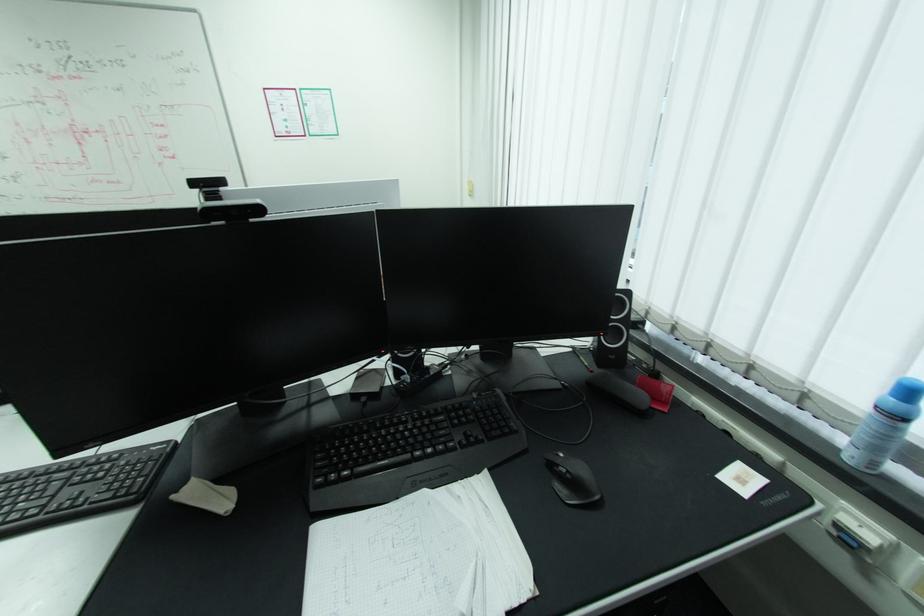
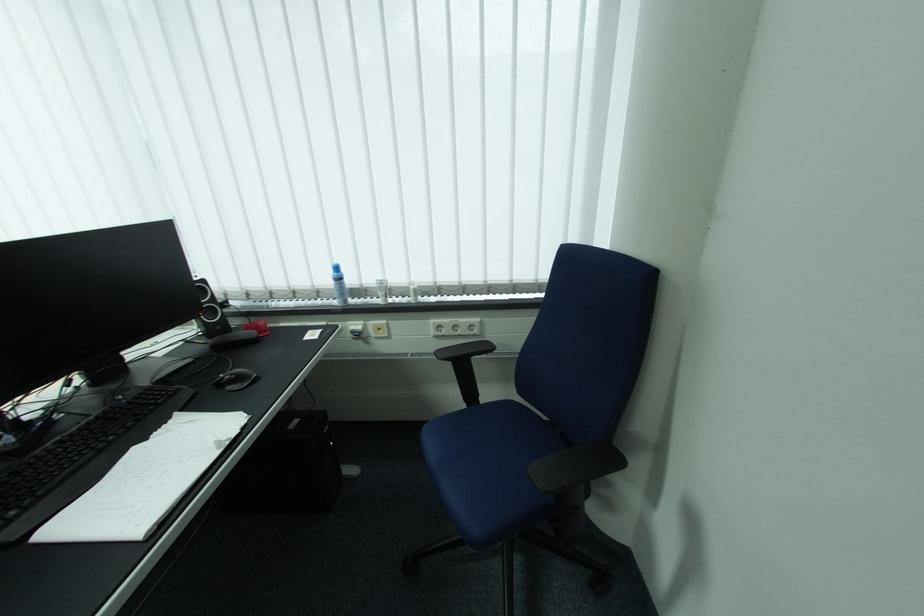
Where in the second image is the point corresponding to pixel 435 450 from the first image?

(117, 438)